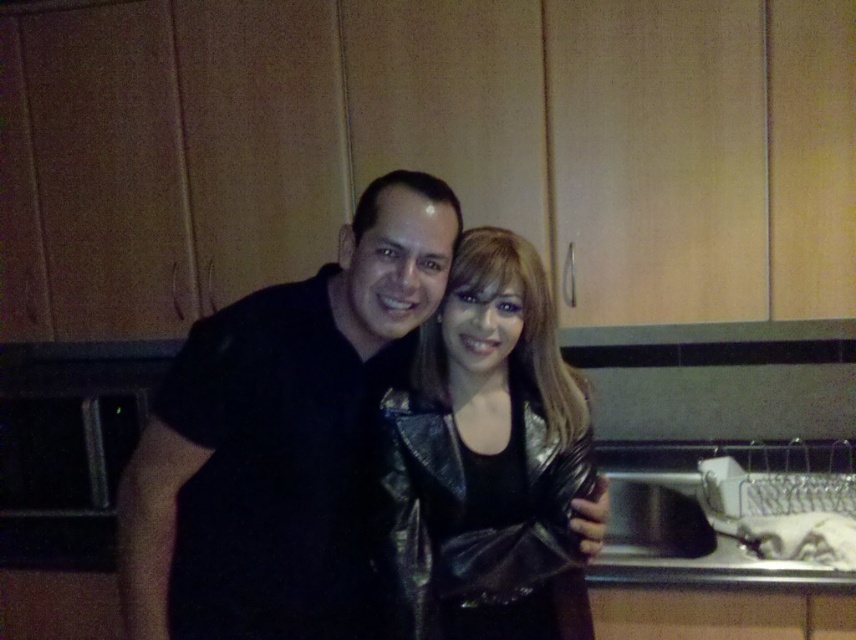
You are trying to decide which jacket to wear for a casual evening out. Both the black leather jacket at center and the shiny metallic jacket at center are options. Based on their sizes, which one would you choose if you prefer a more oversized look?

The black leather jacket at center is larger in size than the shiny metallic jacket at center, so if you prefer an oversized look, you should choose the black leather jacket at center.

You are a tailor measuring jackets for a fitting session. You have a 10 inch long measuring tape. You need to measure the distance between the black leather jacket at center and the shiny metallic jacket at center. Can your tape measure this distance?

The distance between the black leather jacket at center and the shiny metallic jacket at center is 7.77 inches, which is less than the 10 inch measuring tape. Therefore, the tailor can measure the distance between the black leather jacket at center and the shiny metallic jacket at center using the tape.

You are standing in the kitchen and want to place a small bowl at the point marked by coordinates point (282, 440). Which object will the bowl be placed on?

The point (282, 440) is located on the black leather jacket at center, so the bowl will be placed on the black leather jacket at center.